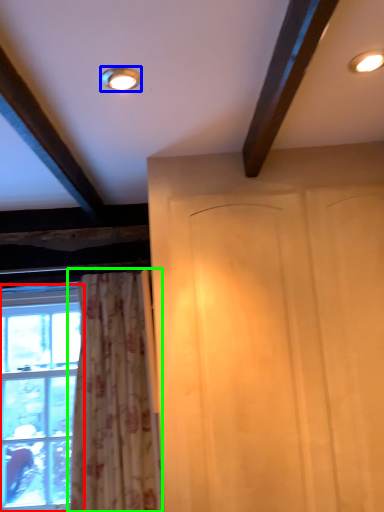
Question: Estimate the real-world distances between objects in this image. Which object is closer to window (highlighted by a red box), lighting (highlighted by a blue box) or curtain (highlighted by a green box)?

Choices:
 (A) lighting
 (B) curtain

Answer: (B)